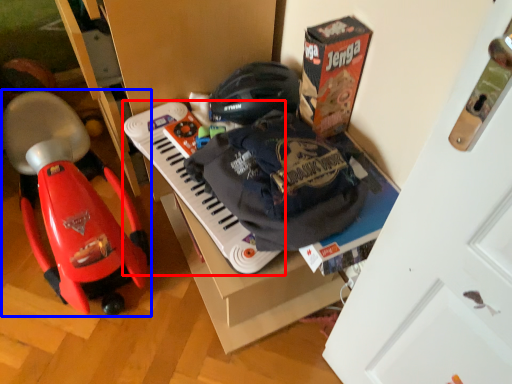
Question: Which object is closer to the camera taking this photo, musical keyboard (highlighted by a red box) or baby carriage (highlighted by a blue box)?

Choices:
 (A) musical keyboard
 (B) baby carriage

Answer: (B)